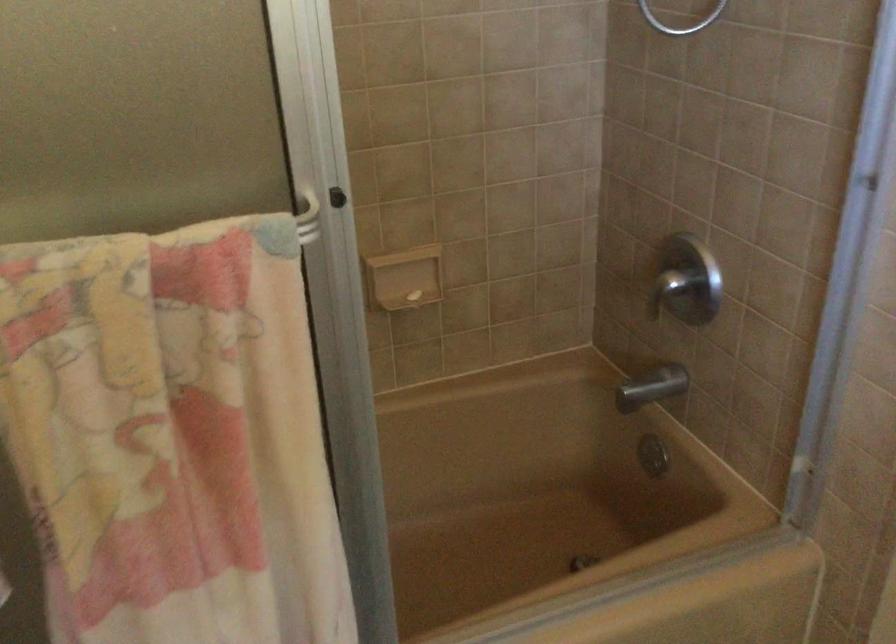
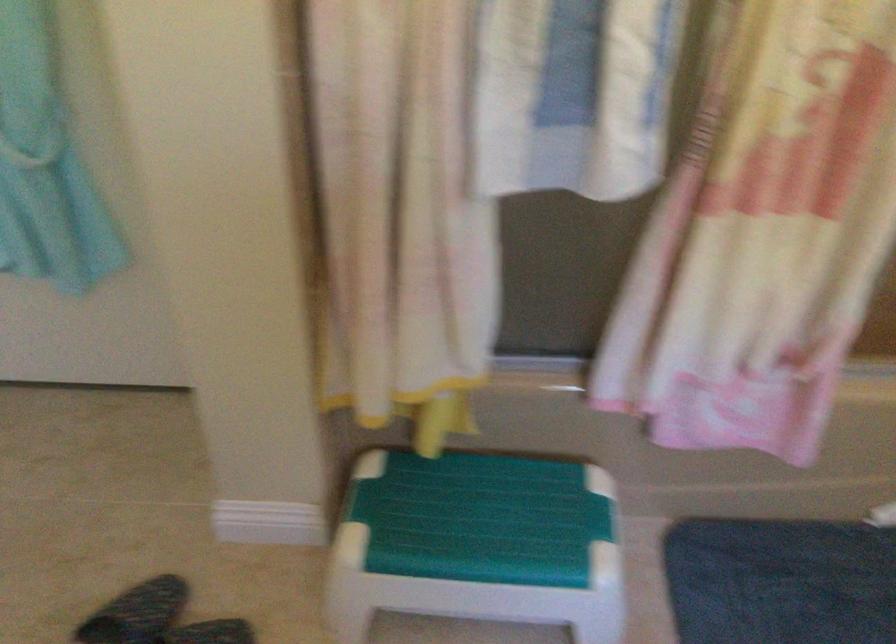
Which direction would the cameraman need to move to produce the second image?

The movement direction of the cameraman is left, backward.